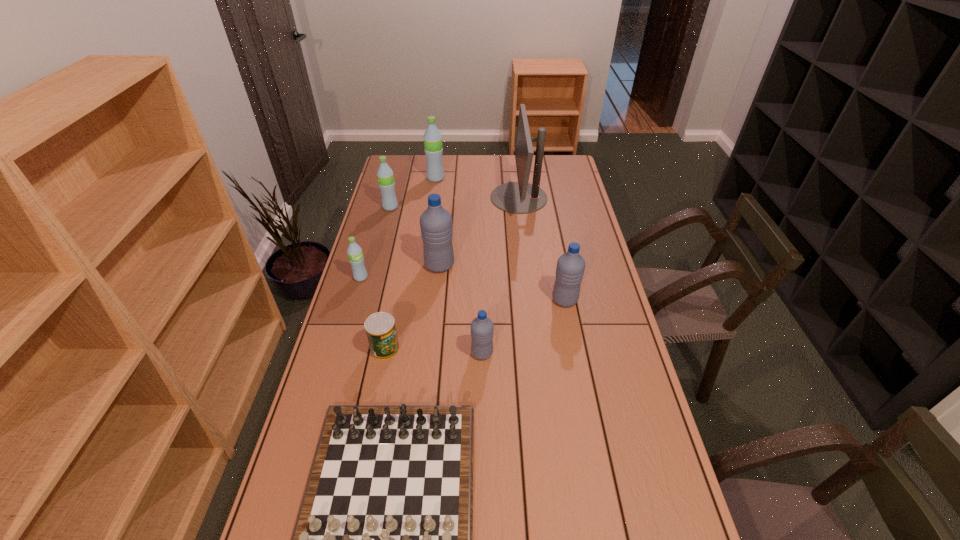
Where is `computer monitor`? computer monitor is located at coordinates (521, 197).

I want to click on the rightmost green water bottle, so click(433, 148).

This screenshot has height=540, width=960. In order to click on the farthest water bottle in this screenshot , I will do `click(433, 148)`.

Find the location of a particular element. the farthest blue water bottle is located at coordinates (436, 226).

Where is `the biggest blue water bottle`? The width and height of the screenshot is (960, 540). the biggest blue water bottle is located at coordinates (436, 226).

Identify the location of the second nearest green water bottle. The height and width of the screenshot is (540, 960). (385, 176).

Identify the location of the second smallest green water bottle. The height and width of the screenshot is (540, 960). (385, 176).

Identify the location of the second nearest blue water bottle. (570, 268).

At what (x,y) coordinates should I click in order to perform the action: click on the fourth nearest object. Please return your answer as a coordinate pair (x, y). The image size is (960, 540). Looking at the image, I should click on (570, 268).

Identify the location of the nearest green water bottle. (356, 259).